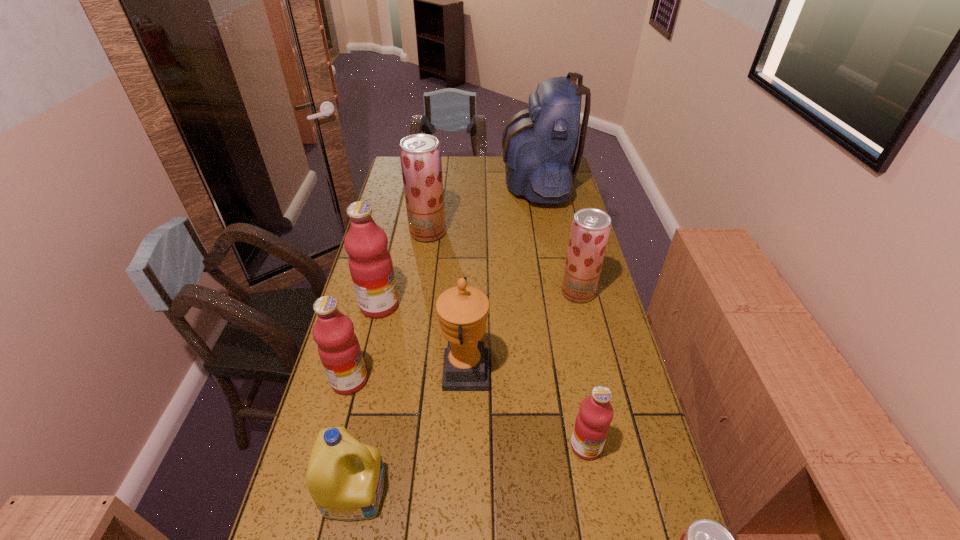
Locate an element on the screen. The image size is (960, 540). the farthest object is located at coordinates (539, 144).

Where is `backpack`? backpack is located at coordinates (539, 144).

What are the coordinates of `the farthest fruit juice` in the screenshot? It's located at (420, 154).

The height and width of the screenshot is (540, 960). I want to click on the second farthest object, so click(x=420, y=154).

At what (x,y) coordinates should I click in order to perform the action: click on the biggest pink fruit juice. Please return your answer as a coordinate pair (x, y). Image resolution: width=960 pixels, height=540 pixels. Looking at the image, I should click on (370, 263).

Locate an element on the screen. This screenshot has height=540, width=960. golden award is located at coordinates [x=462, y=311].

The image size is (960, 540). What are the coordinates of `the fifth object from right to left` in the screenshot? It's located at (462, 311).

Find the location of `the second smallest strawberry fruit juice`. the second smallest strawberry fruit juice is located at coordinates (590, 228).

Identify the location of the second nearest pink fruit juice. The height and width of the screenshot is (540, 960). (339, 350).

I want to click on the second biggest pink fruit juice, so click(x=339, y=350).